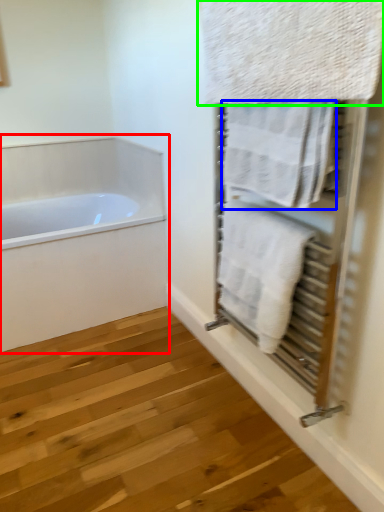
Question: Which object is positioned closest to bathtub (highlighted by a red box)? Select from towel (highlighted by a blue box) and towel (highlighted by a green box).

Choices:
 (A) towel
 (B) towel

Answer: (A)